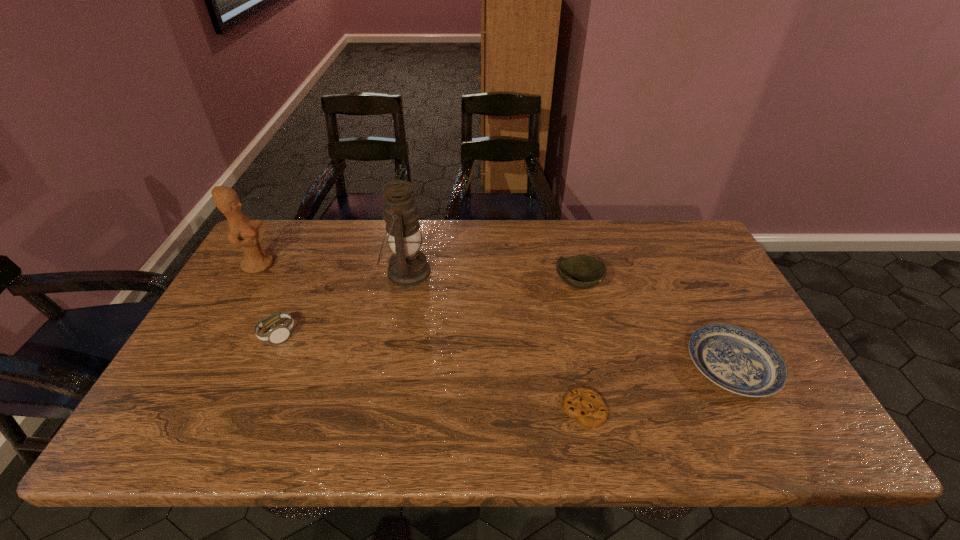
You are a GUI agent. You are given a task and a screenshot of the screen. Output one action in this format:
    pyautogui.click(x=<x>, y=<y>)
    Task: Click on the vacant area at the far edge of the desktop
    This screenshot has height=540, width=960.
    Given the screenshot: What is the action you would take?
    pyautogui.click(x=557, y=255)

Find the location of a particular element. free point at the left edge is located at coordinates (274, 266).

Identify the location of free region at the far left corner of the desktop. This screenshot has height=540, width=960. (295, 239).

This screenshot has height=540, width=960. In the image, there is a desktop. In order to click on vacant space at the far right corner in this screenshot , I will do 708,251.

The width and height of the screenshot is (960, 540). I want to click on vacant area at the near right corner of the desktop, so click(x=748, y=432).

Where is `empty location between the bowl and the shortest object`? empty location between the bowl and the shortest object is located at coordinates (581, 347).

The height and width of the screenshot is (540, 960). I want to click on free space between the leftmost object and the second shortest object, so click(495, 315).

This screenshot has width=960, height=540. In order to click on vacant area between the fifth object from right to left and the third object from left to right in this screenshot , I will do `click(342, 303)`.

The width and height of the screenshot is (960, 540). I want to click on vacant space in between the plate and the watch, so click(505, 350).

This screenshot has width=960, height=540. I want to click on vacant area that lies between the shortest object and the bowl, so click(x=581, y=347).